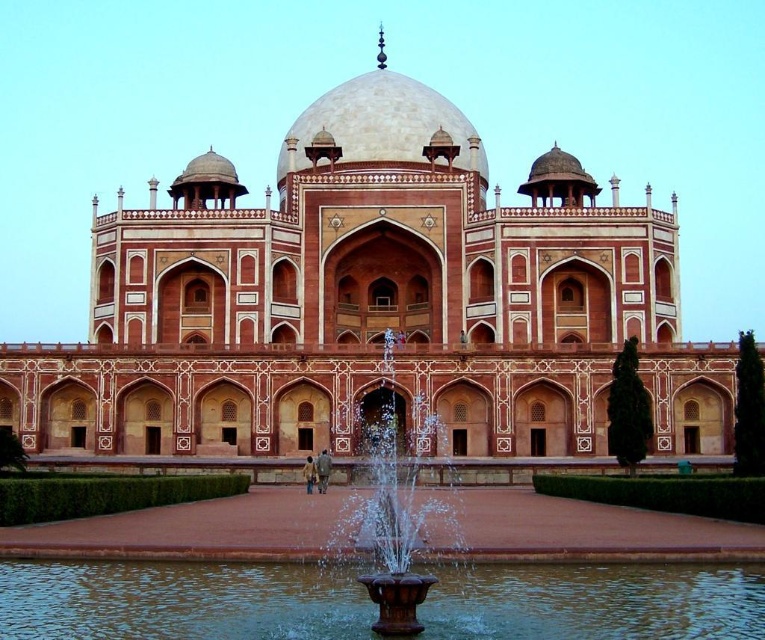
You are standing in front of the grand monument and notice two features at the center. Which one is larger in size between the brown water at center and the brown stone fountain at center?

The brown stone fountain at center is larger than the brown water at center.